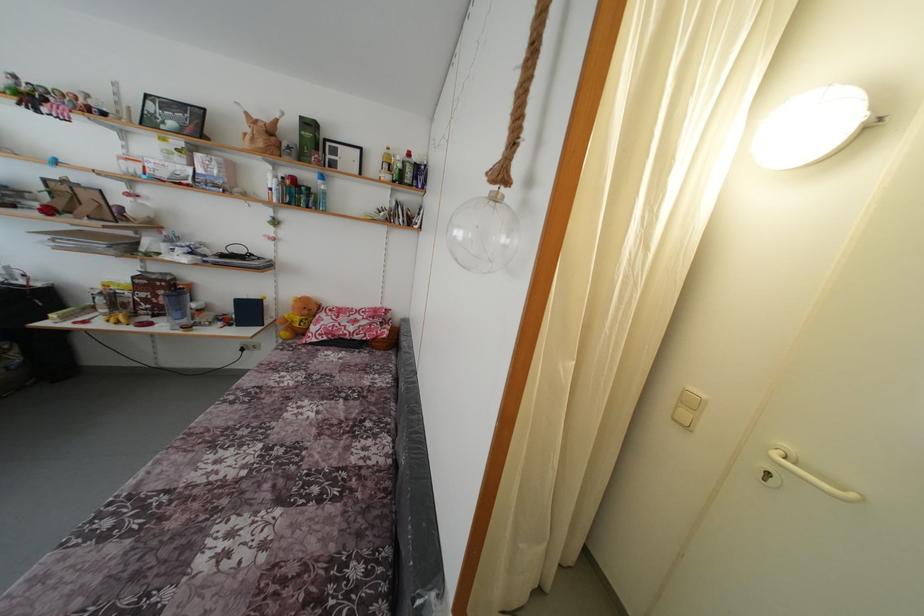
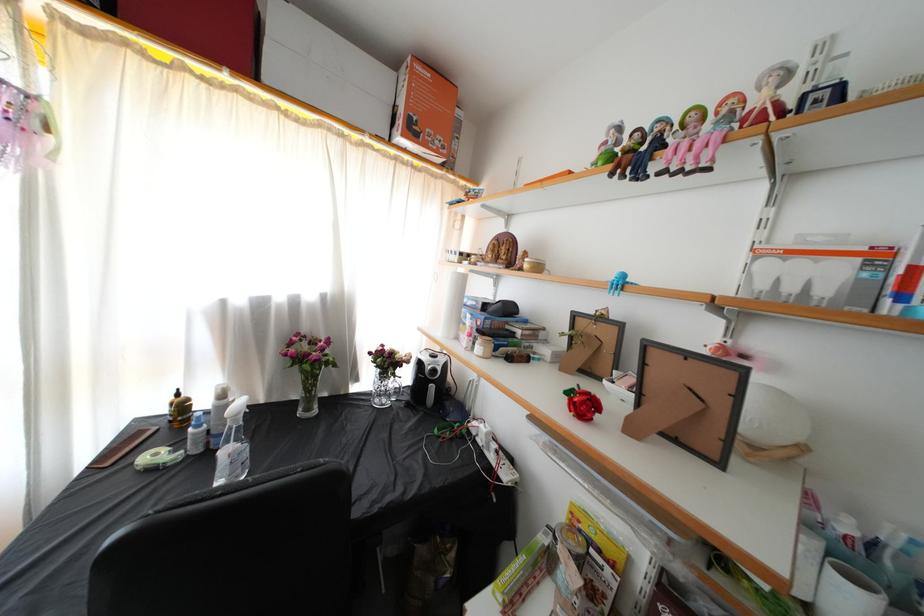
In the second image, find the point that corresponds to (50,116) in the first image.

(659, 172)